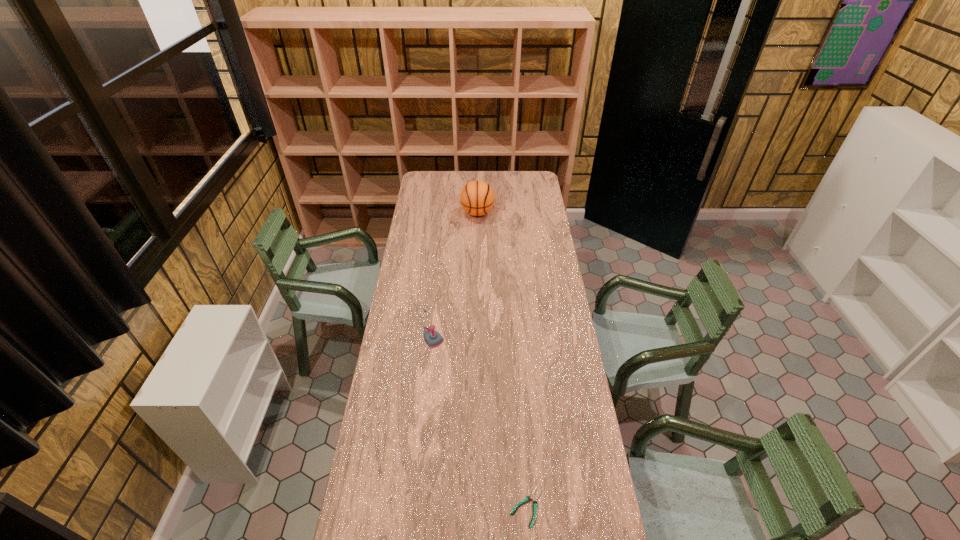
I want to click on the tallest object, so click(x=477, y=198).

Identify the location of basketball. (477, 198).

Locate an element on the screen. The width and height of the screenshot is (960, 540). the leftmost object is located at coordinates (433, 339).

Where is `the second shortest object`? This screenshot has width=960, height=540. the second shortest object is located at coordinates (433, 339).

Locate an element on the screen. The width and height of the screenshot is (960, 540). the nearest object is located at coordinates (528, 498).

Where is `the shortest object`? The height and width of the screenshot is (540, 960). the shortest object is located at coordinates (528, 498).

You are a GUI agent. You are given a task and a screenshot of the screen. Output one action in this format:
    pyautogui.click(x=<x>, y=<y>)
    Task: Click on the blank area located on the left of the second object from left to right
    
    Given the screenshot: What is the action you would take?
    pyautogui.click(x=439, y=213)

Find the location of a particular element. free point located 0.350m on the front of the second tallest object is located at coordinates (417, 426).

This screenshot has height=540, width=960. Identify the location of blank space located 0.140m on the left of the pliers. [x=466, y=507].

Identify the location of object that is at the left edge. This screenshot has width=960, height=540. (433, 339).